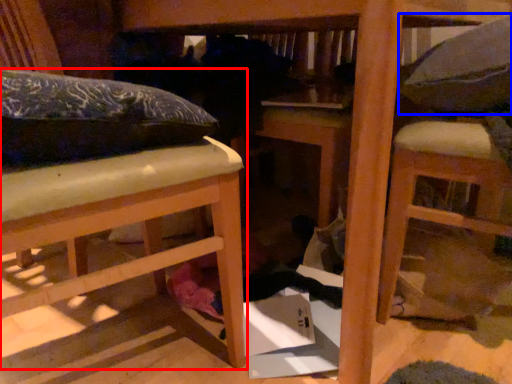
Question: Among these objects, which one is nearest to the camera, furniture (highlighted by a red box) or pillow (highlighted by a blue box)?

Choices:
 (A) furniture
 (B) pillow

Answer: (A)